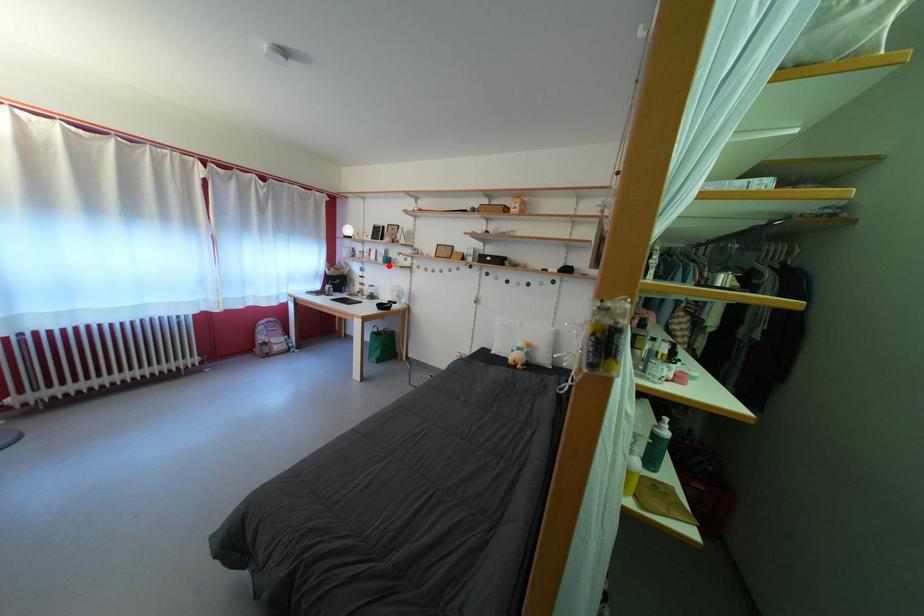
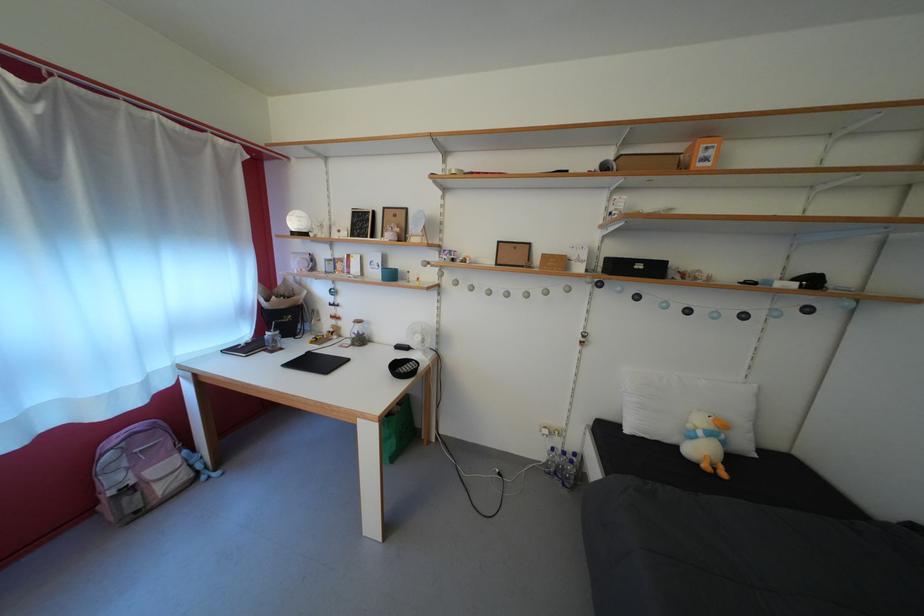
Where in the second image is the point corresponding to the highlighted location from the first image?

(383, 280)